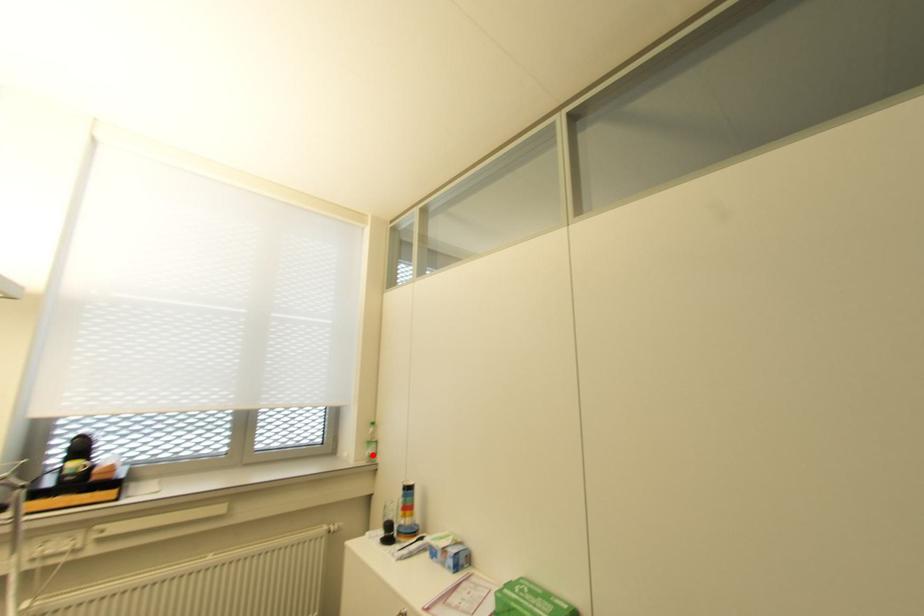
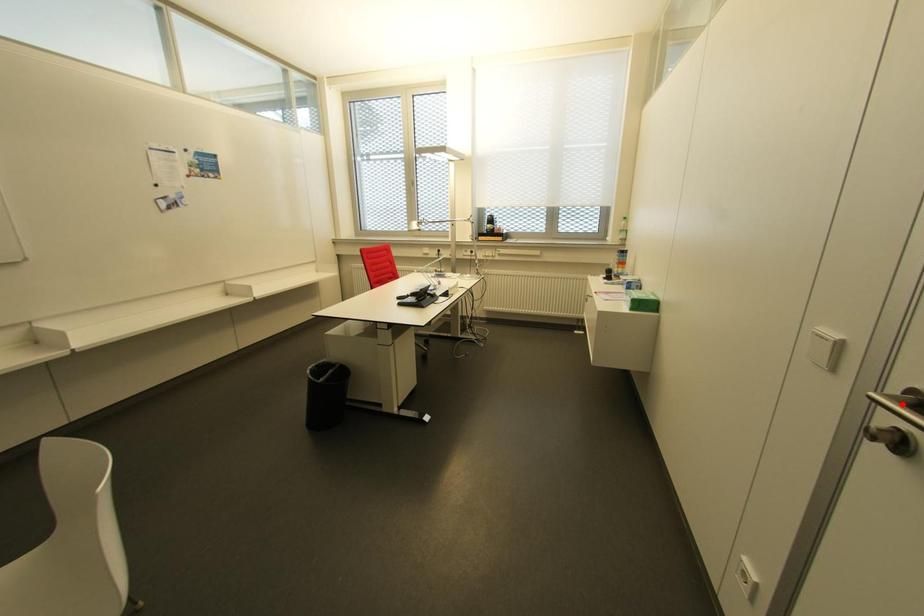
I am providing you with two images of the same scene from different viewpoints. A red point is marked on the first image and another point is marked on the second image. Are the points marked in image1 and image2 representing the same 3D position?

No